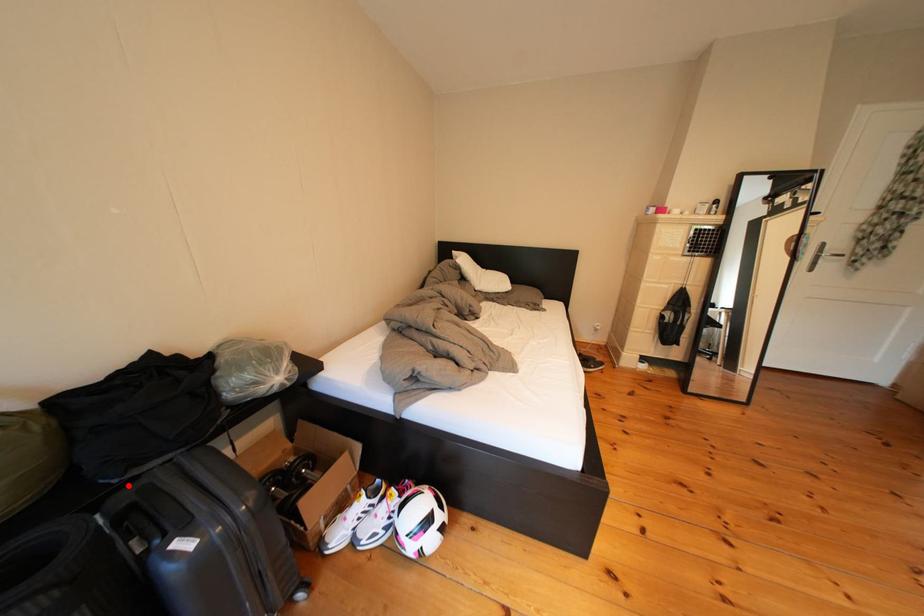
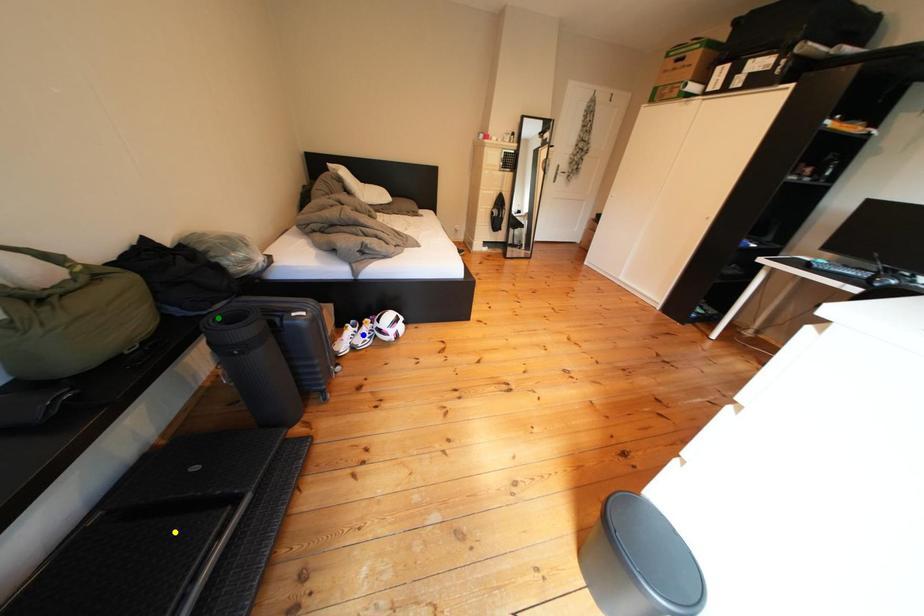
Question: I am providing you with two images of the same scene from different viewpoints. A red point is marked on the first image. You are given multiple points on the second image. Can you choose the point in image 2 that corresponds to the point in image 1?

Choices:
 (A) yellow point
 (B) blue point
 (C) green point

Answer: (C)